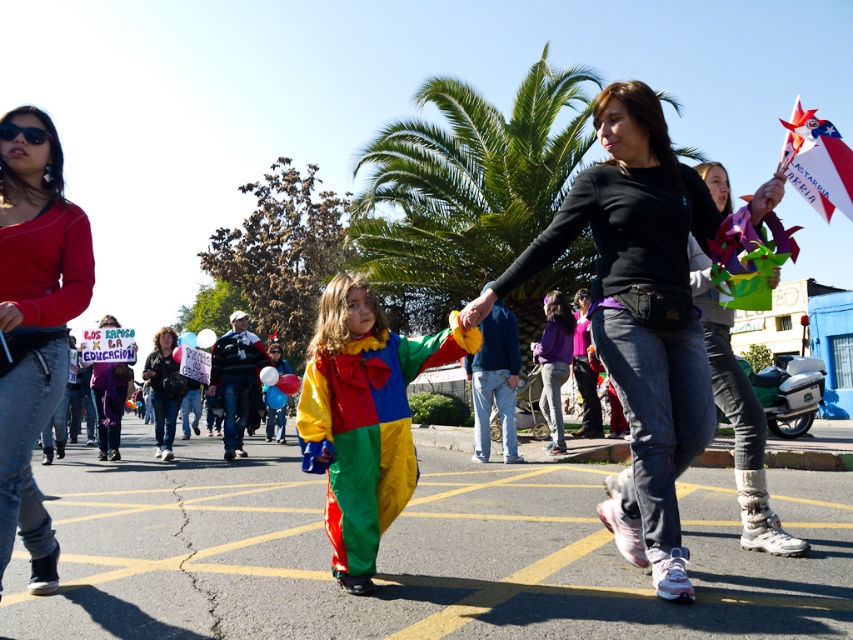
Which of these two, matte black shirt at left or matte black jacket at center, stands shorter?

matte black jacket at center

Does matte black shirt at left appear on the left side of matte black jacket at center?

In fact, matte black shirt at left is to the right of matte black jacket at center.

This screenshot has height=640, width=853. Describe the element at coordinates (33, 324) in the screenshot. I see `matte black shirt at left` at that location.

I want to click on matte black shirt at left, so click(x=33, y=324).

Is black matte shirt at center shorter than multicolored fabric dress at center?

In fact, black matte shirt at center may be taller than multicolored fabric dress at center.

Is black matte shirt at center taller than multicolored fabric dress at center?

Correct, black matte shirt at center is much taller as multicolored fabric dress at center.

Who is more forward, (601, 228) or (779, 552)?

Positioned in front is point (601, 228).

The width and height of the screenshot is (853, 640). I want to click on black matte shirt at center, so click(x=639, y=314).

Can you confirm if multicolored fabric dress at center is bigger than white paper flag at upper right?

Indeed, multicolored fabric dress at center has a larger size compared to white paper flag at upper right.

Which of these two, multicolored fabric dress at center or white paper flag at upper right, stands shorter?

white paper flag at upper right is shorter.

Between point (712, 380) and point (785, 120), which one is positioned behind?

The point (785, 120) is more distant.

Identify the location of multicolored fabric dress at center. The height and width of the screenshot is (640, 853). (738, 419).